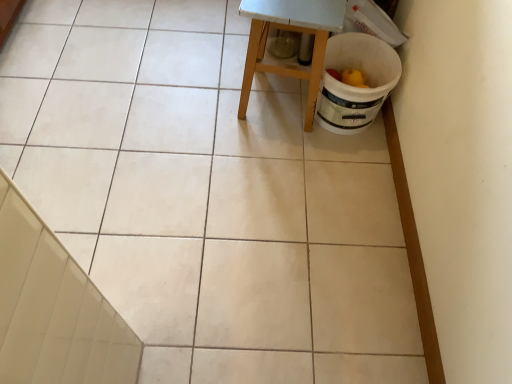
Question: Can you confirm if wooden stool at center is bigger than white glossy tile at lower left?

Choices:
 (A) yes
 (B) no

Answer: (A)

Question: From the image's perspective, is wooden stool at center under white glossy tile at lower left?

Choices:
 (A) no
 (B) yes

Answer: (A)

Question: From a real-world perspective, is wooden stool at center physically above white glossy tile at lower left?

Choices:
 (A) no
 (B) yes

Answer: (A)

Question: Is wooden stool at center touching white glossy tile at lower left?

Choices:
 (A) no
 (B) yes

Answer: (A)

Question: Does wooden stool at center have a lesser height compared to white glossy tile at lower left?

Choices:
 (A) no
 (B) yes

Answer: (B)

Question: From a real-world perspective, does wooden stool at center sit lower than white glossy tile at lower left?

Choices:
 (A) no
 (B) yes

Answer: (B)

Question: Can you confirm if white glossy tile at lower left is smaller than wooden stool at center?

Choices:
 (A) no
 (B) yes

Answer: (B)

Question: Is white glossy tile at lower left completely or partially outside of wooden stool at center?

Choices:
 (A) yes
 (B) no

Answer: (A)

Question: From the image's perspective, is white glossy tile at lower left below wooden stool at center?

Choices:
 (A) yes
 (B) no

Answer: (A)

Question: Is white glossy tile at lower left closer to the viewer compared to wooden stool at center?

Choices:
 (A) no
 (B) yes

Answer: (B)

Question: Can you confirm if white glossy tile at lower left is thinner than wooden stool at center?

Choices:
 (A) no
 (B) yes

Answer: (B)

Question: Is white glossy tile at lower left far from wooden stool at center?

Choices:
 (A) yes
 (B) no

Answer: (A)

Question: Looking at the image, does white glossy tile at lower left seem bigger or smaller compared to wooden stool at center?

Choices:
 (A) big
 (B) small

Answer: (B)